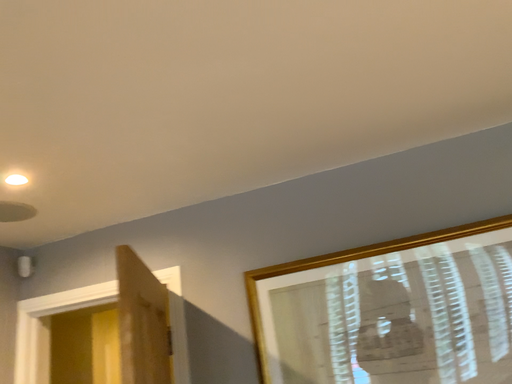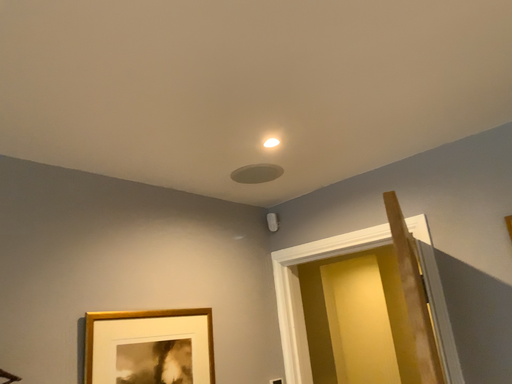
Question: How did the camera likely rotate when shooting the video?

Choices:
 (A) rotated left
 (B) rotated right

Answer: (A)